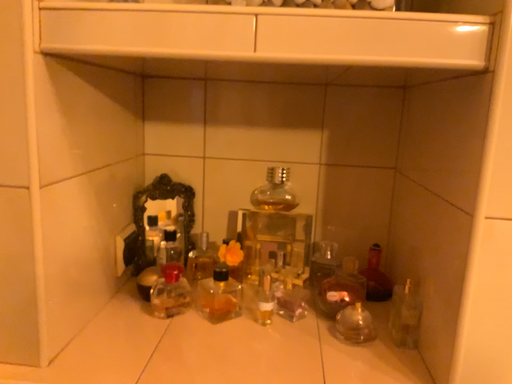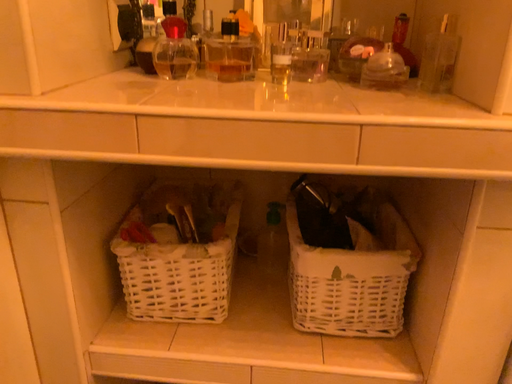
Question: How did the camera likely rotate when shooting the video?

Choices:
 (A) rotated downward
 (B) rotated upward

Answer: (A)